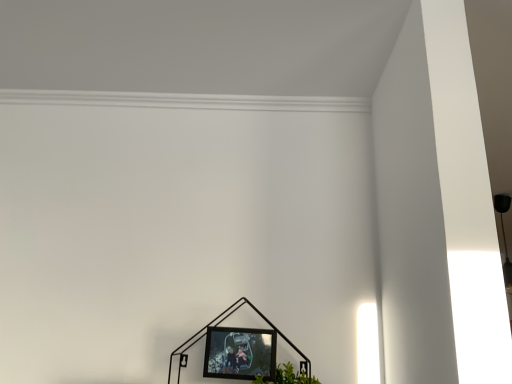
What do you see at coordinates (240, 353) in the screenshot? This screenshot has height=384, width=512. I see `black matte picture frame at center` at bounding box center [240, 353].

Identify the location of black matte picture frame at center. (240, 353).

Locate an element on the screen. This screenshot has width=512, height=384. black matte picture frame at center is located at coordinates (240, 353).